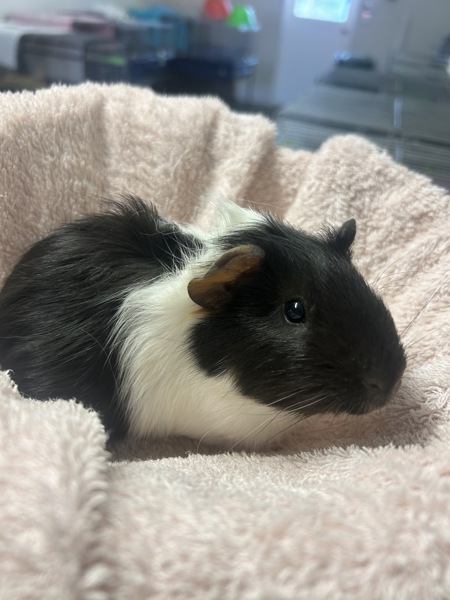
At what (x,y) coordinates should I click in order to perform the action: click on door. Please return your answer as a coordinate pair (x, y). Looking at the image, I should click on (301, 40).